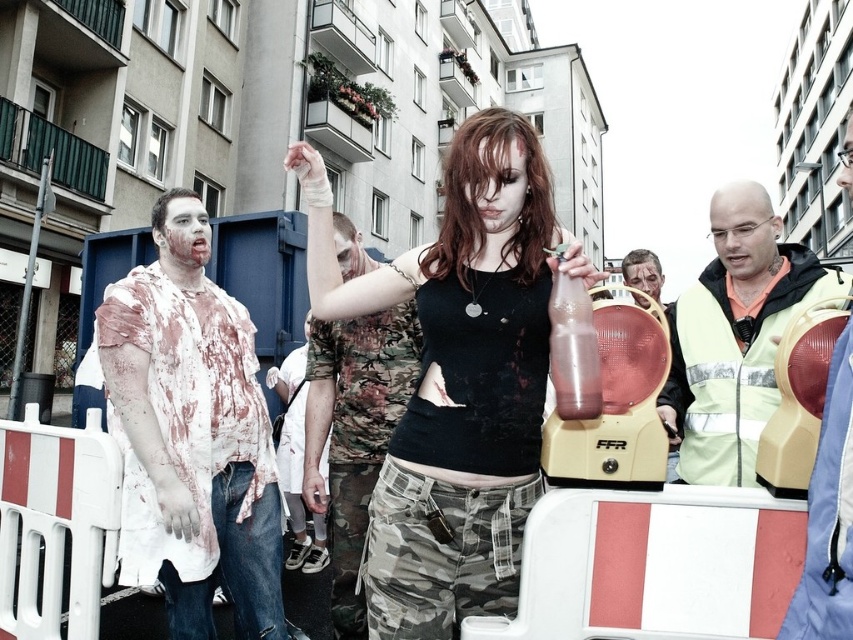
Between point (749, 385) and point (592, 403), which one is positioned behind?

The point (749, 385) is behind.

What do you see at coordinates (734, 337) in the screenshot? The height and width of the screenshot is (640, 853). I see `light green reflective vest at center right` at bounding box center [734, 337].

Is point (775, 339) behind point (556, 385)?

Yes.

The width and height of the screenshot is (853, 640). What are the coordinates of `light green reflective vest at center right` in the screenshot? It's located at (734, 337).

Can you confirm if light green reflective vest at center right is positioned to the left of matte black face paint at center?

Yes, light green reflective vest at center right is to the left of matte black face paint at center.

Does light green reflective vest at center right come in front of matte black face paint at center?

That is True.

Measure the distance between point (694, 371) and camera.

Point (694, 371) and camera are 4.06 meters apart.

Where is `light green reflective vest at center right`? The height and width of the screenshot is (640, 853). light green reflective vest at center right is located at coordinates (734, 337).

Can you confirm if camouflage-patterned shirt at center is thinner than translucent plastic bottle at center?

No, camouflage-patterned shirt at center is not thinner than translucent plastic bottle at center.

Which is more to the right, camouflage-patterned shirt at center or translucent plastic bottle at center?

From the viewer's perspective, translucent plastic bottle at center appears more on the right side.

This screenshot has width=853, height=640. I want to click on camouflage-patterned shirt at center, so click(x=354, y=433).

Where is `camouflage-patterned shirt at center`? This screenshot has height=640, width=853. camouflage-patterned shirt at center is located at coordinates (354, 433).